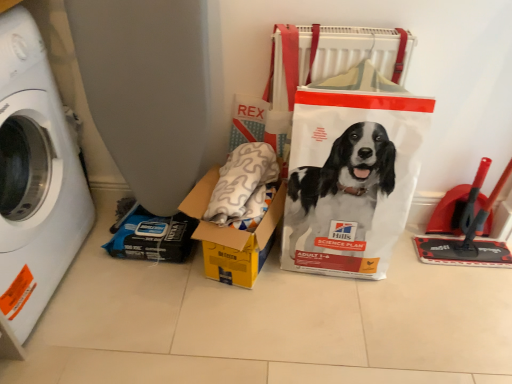
Question: Does yellow cardboard box at center have a smaller size compared to white plastic bag at center?

Choices:
 (A) no
 (B) yes

Answer: (B)

Question: Are yellow cardboard box at center and white plastic bag at center located far from each other?

Choices:
 (A) yes
 (B) no

Answer: (B)

Question: Is yellow cardboard box at center wider than white plastic bag at center?

Choices:
 (A) no
 (B) yes

Answer: (B)

Question: Is white plastic bag at center at the back of yellow cardboard box at center?

Choices:
 (A) yes
 (B) no

Answer: (B)

Question: Is yellow cardboard box at center surrounding white plastic bag at center?

Choices:
 (A) yes
 (B) no

Answer: (B)

Question: Based on their sizes in the image, would you say yellow cardboard box at center is bigger or smaller than white plastic washing machine at left?

Choices:
 (A) small
 (B) big

Answer: (A)

Question: From a real-world perspective, is yellow cardboard box at center above or below white plastic washing machine at left?

Choices:
 (A) above
 (B) below

Answer: (B)

Question: Is yellow cardboard box at center to the left or to the right of white plastic washing machine at left in the image?

Choices:
 (A) left
 (B) right

Answer: (B)

Question: Is point (218, 261) closer or farther from the camera than point (29, 301)?

Choices:
 (A) farther
 (B) closer

Answer: (A)

Question: Is point (310, 132) closer or farther from the camera than point (15, 306)?

Choices:
 (A) farther
 (B) closer

Answer: (A)

Question: Visually, is white plastic bag at center positioned to the left or to the right of white plastic washing machine at left?

Choices:
 (A) left
 (B) right

Answer: (B)

Question: Is white plastic bag at center inside or outside of white plastic washing machine at left?

Choices:
 (A) inside
 (B) outside

Answer: (B)

Question: From the image's perspective, is white plastic bag at center positioned above or below white plastic washing machine at left?

Choices:
 (A) above
 (B) below

Answer: (B)

Question: From a real-world perspective, is white plastic bag at center above or below yellow cardboard box at center?

Choices:
 (A) below
 (B) above

Answer: (B)

Question: Looking at their shapes, would you say white plastic bag at center is wider or thinner than yellow cardboard box at center?

Choices:
 (A) thin
 (B) wide

Answer: (A)